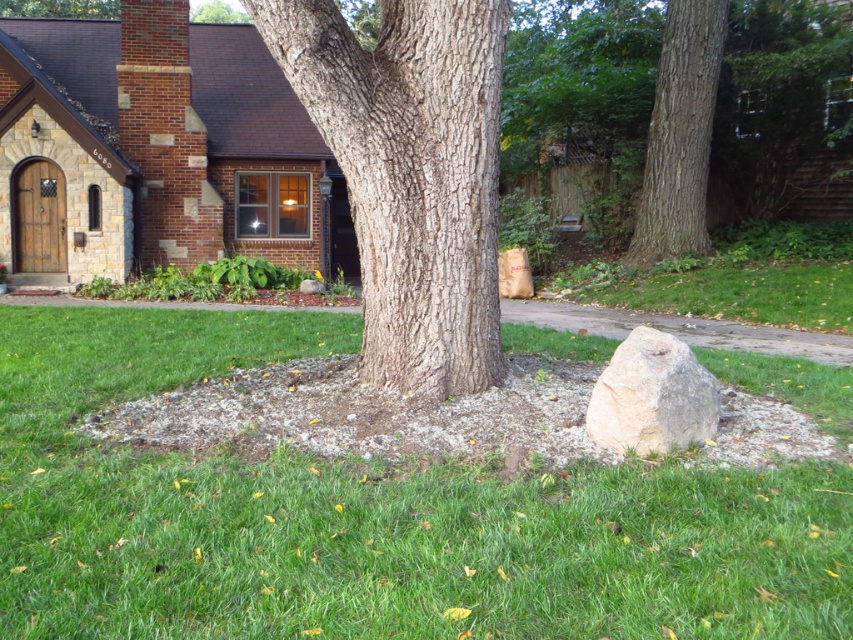
Measure the distance from green grass at center to rough bark tree trunk at upper center.

green grass at center and rough bark tree trunk at upper center are 14.91 meters apart.

Looking at this image, which of these two, green grass at center or rough bark tree trunk at upper center, stands taller?

rough bark tree trunk at upper center is taller.

Is point (704, 532) positioned in front of point (697, 72)?

Yes, it is in front of point (697, 72).

Find the location of `green grass at center`. green grass at center is located at coordinates (370, 516).

Does green grass at center have a lesser width compared to smooth bark tree at center?

Yes.

How far apart are green grass at center and smooth bark tree at center?

green grass at center is 3.30 meters from smooth bark tree at center.

I want to click on green grass at center, so click(x=370, y=516).

Can you confirm if rough bark tree trunk at upper center is thinner than smooth beige rock at center?

No, rough bark tree trunk at upper center is not thinner than smooth beige rock at center.

Measure the distance between point (706, 48) and camera.

Point (706, 48) is 15.57 meters from camera.

Is point (683, 74) in front of point (686, 390)?

No, (683, 74) is behind (686, 390).

Identify the location of rough bark tree trunk at upper center. The image size is (853, 640). (680, 132).